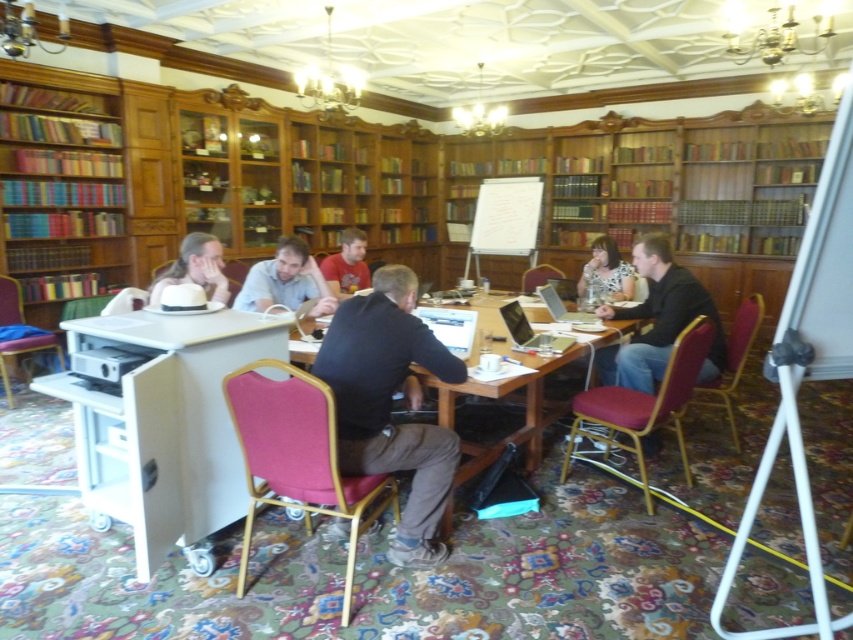
Which is below, wooden bookshelf at left or matte red shirt at center?

matte red shirt at center is lower down.

Who is taller, wooden bookshelf at left or matte red shirt at center?

wooden bookshelf at left

Image resolution: width=853 pixels, height=640 pixels. What do you see at coordinates (61, 188) in the screenshot? I see `wooden bookshelf at left` at bounding box center [61, 188].

At what (x,y) coordinates should I click in order to perform the action: click on wooden bookshelf at left. Please return your answer as a coordinate pair (x, y). Image resolution: width=853 pixels, height=640 pixels. Looking at the image, I should click on (61, 188).

You are a GUI agent. You are given a task and a screenshot of the screen. Output one action in this format:
    pyautogui.click(x=<x>, y=<y>)
    Task: Click on the wooden table at center
    This screenshot has width=853, height=640.
    Given the screenshot: What is the action you would take?
    pyautogui.click(x=392, y=397)

Is wooden table at center bigger than matte red shirt at center?

Indeed, wooden table at center has a larger size compared to matte red shirt at center.

Describe the element at coordinates (392, 397) in the screenshot. I see `wooden table at center` at that location.

The width and height of the screenshot is (853, 640). In order to click on wooden table at center in this screenshot , I will do `click(392, 397)`.

Who is taller, black shirt at center or matte red shirt at center?

black shirt at center is taller.

Describe the element at coordinates (659, 321) in the screenshot. I see `black shirt at center` at that location.

Is point (653, 360) more distant than point (364, 264)?

No, (653, 360) is in front of (364, 264).

I want to click on black shirt at center, so click(659, 321).